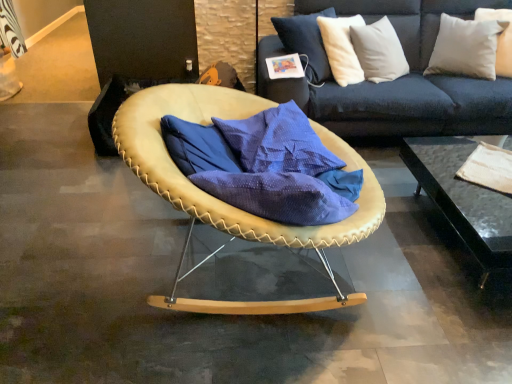
Question: Would you say black glass table at lower right is inside or outside white cotton pillow at upper right, arranged as the first pillow when viewed from the left?

Choices:
 (A) outside
 (B) inside

Answer: (A)

Question: Considering the positions of point (507, 223) and point (444, 61), is point (507, 223) closer or farther from the camera than point (444, 61)?

Choices:
 (A) farther
 (B) closer

Answer: (B)

Question: Which is nearer to the leather-like beige chair at center?

Choices:
 (A) white cotton pillow at upper right, arranged as the 2th pillow when viewed from the right
 (B) black glass table at lower right
 (C) leather-like tan chair at center
 (D) white soft pillow at upper right, placed as the 2th pillow when sorted from left to right

Answer: (C)

Question: Based on their relative distances, which object is farther from the white soft pillow at upper right, placed as the 2th pillow when sorted from left to right?

Choices:
 (A) leather-like tan chair at center
 (B) leather-like beige chair at center
 (C) white cotton pillow at upper right, arranged as the 2th pillow when viewed from the right
 (D) black glass table at lower right

Answer: (B)